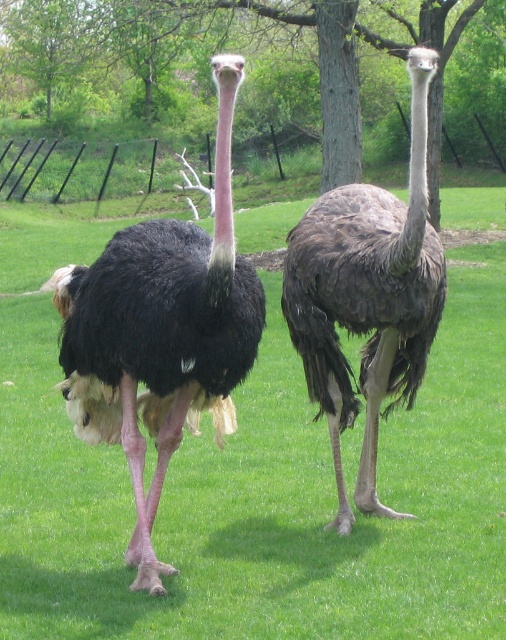
You are an ornithologist observing two points on an ostrich image. The first point is at coordinates point (120, 256) and the second is at point (372, 225). Which point is nearer to you?

Point (120, 256) is closer to the viewer than point (372, 225).

You are a birdwatcher observing two ostriches in a grassy area. You notice the green grass at center and the dark brown feathers at center. Which object is located above the other?

The green grass at center is positioned over dark brown feathers at center, meaning the green grass is above the dark brown feathers.

Based on the photo, you are an ornithologist observing two ostriches in a grassy area. You notice the black feathered ostrich at center and the dark brown feathers at center. Which of these two ostriches is shorter in height?

The black feathered ostrich at center is shorter in height compared to the dark brown feathers at center.